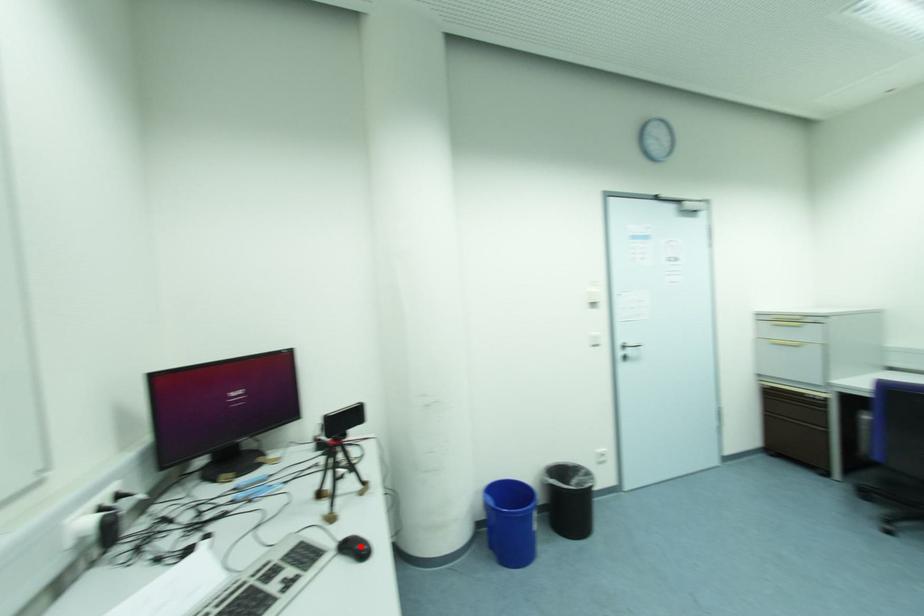
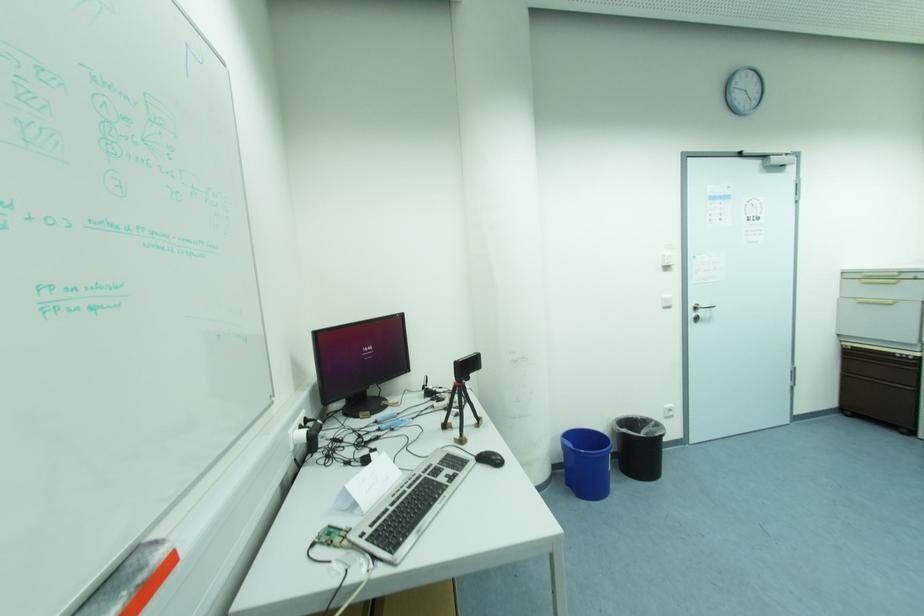
Find the pixel in the second image that matches the highlighted location in the first image.

(494, 458)